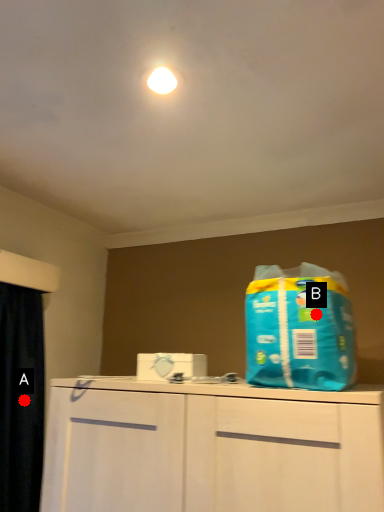
Question: Two points are circled on the image, labeled by A and B beside each circle. Which point is further to the camera?

Choices:
 (A) A is further
 (B) B is further

Answer: (A)